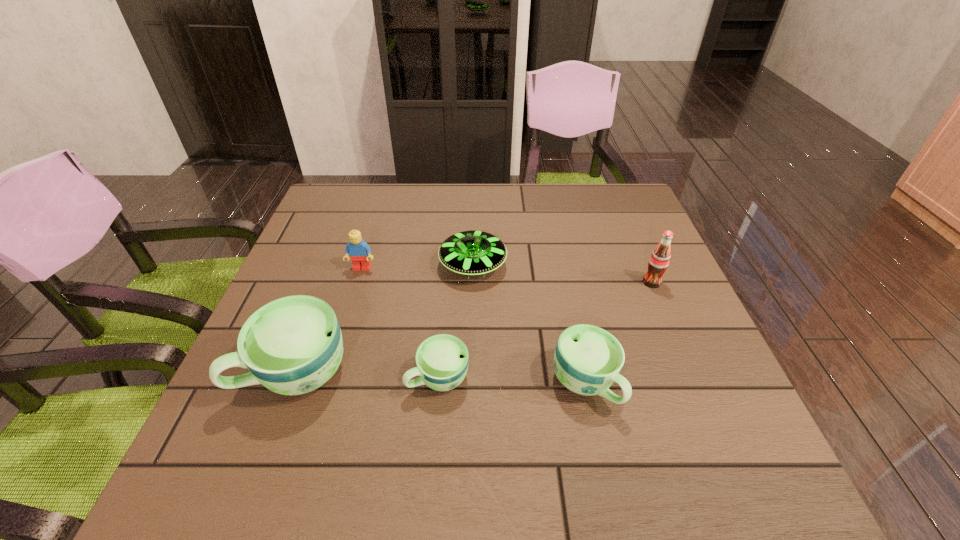
You are a GUI agent. You are given a task and a screenshot of the screen. Output one action in this format:
    pyautogui.click(x=<x>, y=<y>)
    Task: Click on the leftmost cup
    The width and height of the screenshot is (960, 540).
    Given the screenshot: What is the action you would take?
    pyautogui.click(x=293, y=345)

Where is `the second cup from right to left`? The height and width of the screenshot is (540, 960). the second cup from right to left is located at coordinates (442, 360).

Find the location of a particular element. This screenshot has height=540, width=960. the second tallest cup is located at coordinates (587, 360).

This screenshot has width=960, height=540. I want to click on the rightmost cup, so click(587, 360).

Where is `saucer`? The height and width of the screenshot is (540, 960). saucer is located at coordinates (472, 253).

This screenshot has height=540, width=960. Find the location of `Lego`. Lego is located at coordinates (359, 251).

Find the location of a particular element. The height and width of the screenshot is (540, 960). soda is located at coordinates (659, 260).

Where is `vacant space situated 0.100m on the back of the leftmost cup`? Image resolution: width=960 pixels, height=540 pixels. vacant space situated 0.100m on the back of the leftmost cup is located at coordinates (322, 304).

This screenshot has height=540, width=960. In order to click on blank area located 0.180m on the left of the second cup from right to left in this screenshot , I will do `click(316, 378)`.

I want to click on free region located 0.270m on the left of the rightmost cup, so click(412, 384).